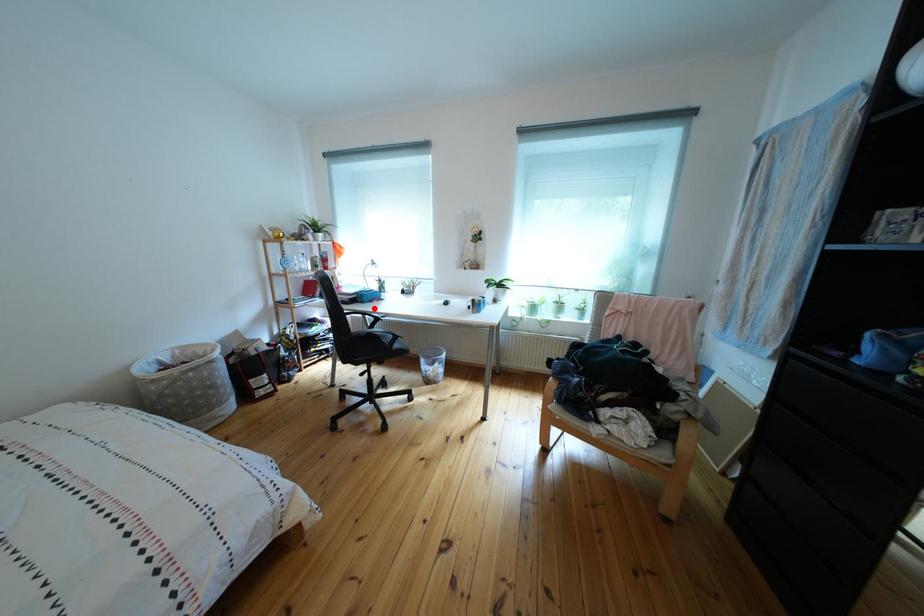
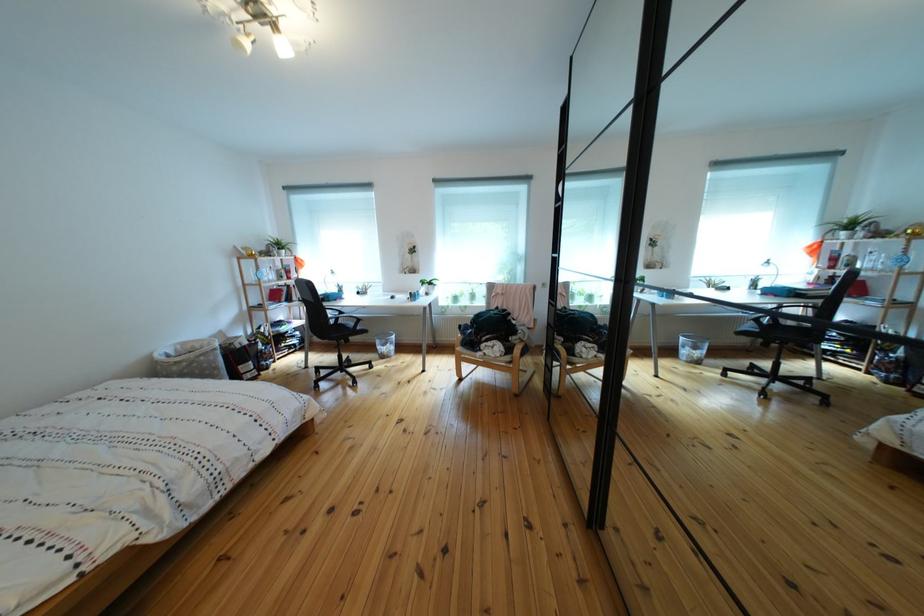
Question: I am providing you with two images of the same scene from different viewpoints. In image1, a red point is highlighted. Considering the same 3D point in image2, which of the following is correct?

Choices:
 (A) It is closer
 (B) It is farther

Answer: (A)